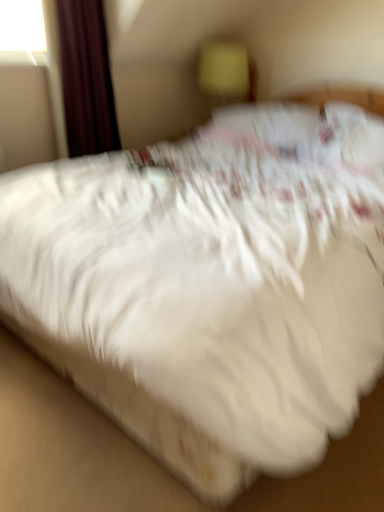
What do you see at coordinates (86, 78) in the screenshot? The width and height of the screenshot is (384, 512). I see `dark red velvet curtain at upper left` at bounding box center [86, 78].

Identify the location of dark red velvet curtain at upper left. This screenshot has width=384, height=512. [86, 78].

What are the coordinates of `yellow fabric at upper center` in the screenshot? It's located at (224, 69).

This screenshot has width=384, height=512. What do you see at coordinates (224, 69) in the screenshot?
I see `yellow fabric at upper center` at bounding box center [224, 69].

The height and width of the screenshot is (512, 384). In order to click on dark red velvet curtain at upper left in this screenshot , I will do `click(86, 78)`.

Is dark red velvet curtain at upper left at the right side of yellow fabric at upper center?

Incorrect, dark red velvet curtain at upper left is not on the right side of yellow fabric at upper center.

Is the position of dark red velvet curtain at upper left more distant than that of yellow fabric at upper center?

No, dark red velvet curtain at upper left is closer to the viewer.

Is point (76, 70) in front of point (228, 78)?

That is True.

From the image's perspective, is dark red velvet curtain at upper left beneath yellow fabric at upper center?

Yes.

From a real-world perspective, is dark red velvet curtain at upper left below yellow fabric at upper center?

No, from a real-world perspective, dark red velvet curtain at upper left is not below yellow fabric at upper center.

Between dark red velvet curtain at upper left and yellow fabric at upper center, which one has larger width?

yellow fabric at upper center is wider.

Considering the sizes of dark red velvet curtain at upper left and yellow fabric at upper center in the image, is dark red velvet curtain at upper left taller or shorter than yellow fabric at upper center?

In the image, dark red velvet curtain at upper left appears to be taller than yellow fabric at upper center.

Looking at the image, does dark red velvet curtain at upper left seem bigger or smaller compared to yellow fabric at upper center?

In the image, dark red velvet curtain at upper left appears to be larger than yellow fabric at upper center.

Is dark red velvet curtain at upper left not within yellow fabric at upper center?

dark red velvet curtain at upper left lies outside yellow fabric at upper center's area.

Is dark red velvet curtain at upper left next to yellow fabric at upper center and touching it?

No, dark red velvet curtain at upper left is not with yellow fabric at upper center.

Does dark red velvet curtain at upper left turn towards yellow fabric at upper center?

No, dark red velvet curtain at upper left is not facing towards yellow fabric at upper center.

How many degrees apart are the facing directions of dark red velvet curtain at upper left and yellow fabric at upper center?

dark red velvet curtain at upper left and yellow fabric at upper center are facing 88.4 degrees away from each other.

At what (x,y) coordinates should I click in order to perform the action: click on table lamp below the dark red velvet curtain at upper left (from a real-world perspective). Please return your answer as a coordinate pair (x, y). The height and width of the screenshot is (512, 384). Looking at the image, I should click on (224, 69).

Which is more to the right, yellow fabric at upper center or dark red velvet curtain at upper left?

Positioned to the right is yellow fabric at upper center.

In the image, is yellow fabric at upper center positioned in front of or behind dark red velvet curtain at upper left?

In the image, yellow fabric at upper center appears behind dark red velvet curtain at upper left.

Which is closer to the camera, (226, 95) or (70, 7)?

Point (226, 95).

From the image's perspective, which one is positioned lower, yellow fabric at upper center or dark red velvet curtain at upper left?

dark red velvet curtain at upper left appears lower in the image.

From a real-world perspective, is yellow fabric at upper center positioned above or below dark red velvet curtain at upper left?

In terms of real-world spatial position, yellow fabric at upper center is below dark red velvet curtain at upper left.

Can you confirm if yellow fabric at upper center is wider than dark red velvet curtain at upper left?

Indeed, yellow fabric at upper center has a greater width compared to dark red velvet curtain at upper left.

Does yellow fabric at upper center have a lesser height compared to dark red velvet curtain at upper left?

Yes, yellow fabric at upper center is shorter than dark red velvet curtain at upper left.

Is yellow fabric at upper center bigger than dark red velvet curtain at upper left?

Actually, yellow fabric at upper center might be smaller than dark red velvet curtain at upper left.

Would you say yellow fabric at upper center is outside dark red velvet curtain at upper left?

That's correct, yellow fabric at upper center is outside of dark red velvet curtain at upper left.

Is yellow fabric at upper center positioned far away from dark red velvet curtain at upper left?

No, yellow fabric at upper center is not far away from dark red velvet curtain at upper left.

From the picture: Does yellow fabric at upper center turn towards dark red velvet curtain at upper left?

Yes, yellow fabric at upper center is facing dark red velvet curtain at upper left.

What's the angular difference between yellow fabric at upper center and dark red velvet curtain at upper left's facing directions?

They differ by 88.4 degrees in their facing directions.

The width and height of the screenshot is (384, 512). What are the coordinates of `table lamp behind the dark red velvet curtain at upper left` in the screenshot? It's located at click(224, 69).

Locate an element on the screen. curtain on the left of yellow fabric at upper center is located at coordinates (86, 78).

This screenshot has width=384, height=512. What are the coordinates of `curtain located below the yellow fabric at upper center (from the image's perspective)` in the screenshot? It's located at (86, 78).